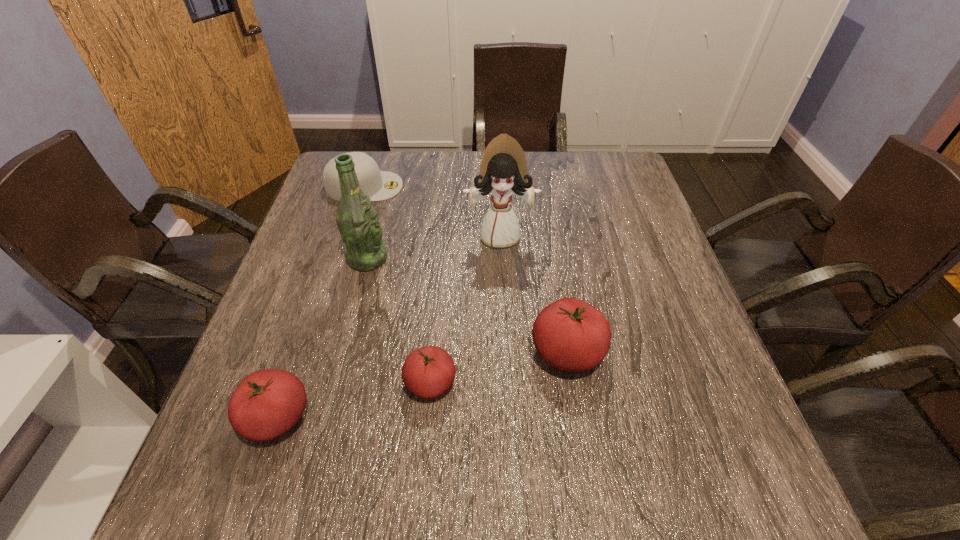
Identify the location of the leftmost tomato. Image resolution: width=960 pixels, height=540 pixels. (267, 403).

This screenshot has height=540, width=960. What are the coordinates of `the third shortest object` in the screenshot? It's located at (267, 403).

Where is `the second tomato from right to left`? the second tomato from right to left is located at coordinates (428, 372).

At what (x,y) coordinates should I click in order to perform the action: click on the third object from right to left. Please return your answer as a coordinate pair (x, y). Looking at the image, I should click on (428, 372).

What are the coordinates of `the rightmost tomato` in the screenshot? It's located at (569, 334).

You are a GUI agent. You are given a task and a screenshot of the screen. Output one action in this format:
    pyautogui.click(x=<x>, y=<y>)
    Task: Click on the fourth shortest object
    This screenshot has height=540, width=960.
    Given the screenshot: What is the action you would take?
    pyautogui.click(x=569, y=334)

Find the location of a particular element. The height and width of the screenshot is (540, 960). cap is located at coordinates (379, 185).

This screenshot has height=540, width=960. What are the coordinates of `doll` in the screenshot? It's located at pyautogui.click(x=503, y=172).

Locate an element on the screen. This screenshot has width=960, height=540. beer bottle is located at coordinates (358, 222).

Identify the location of vacant space located 0.110m on the right of the second tallest tomato. The height and width of the screenshot is (540, 960). (373, 417).